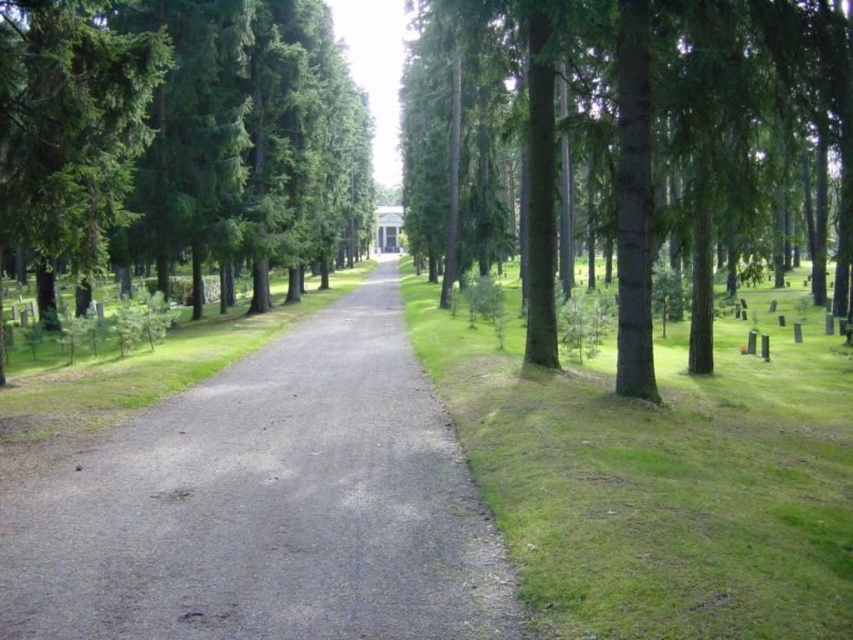
Measure the distance from green grass at right to green smooth tree at upper center.

green grass at right is 8.90 meters away from green smooth tree at upper center.

This screenshot has height=640, width=853. What do you see at coordinates (659, 483) in the screenshot? I see `green grass at right` at bounding box center [659, 483].

Which is behind, point (492, 401) or point (653, 248)?

The point (653, 248) is behind.

You are a GUI agent. You are given a task and a screenshot of the screen. Output one action in this format:
    pyautogui.click(x=<x>, y=<y>)
    Task: Click on the green grass at right
    The width and height of the screenshot is (853, 640).
    Given the screenshot: What is the action you would take?
    pyautogui.click(x=659, y=483)

Between gray gravel path at center and green grass at right, which one is positioned higher?

Positioned higher is green grass at right.

Identify the location of gray gravel path at center. The image size is (853, 640). (267, 506).

Consider the image. Can you confirm if green smooth tree at upper center is taller than green matte tree at left?

No.

Where is `green smooth tree at upper center`? This screenshot has width=853, height=640. green smooth tree at upper center is located at coordinates (635, 138).